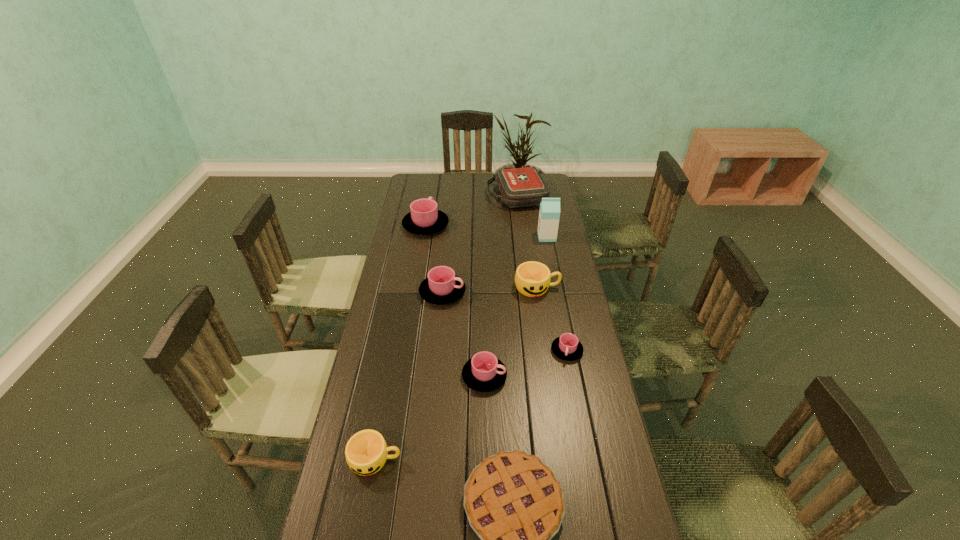
What are the coordinates of `the left beige cup` in the screenshot? It's located at (366, 452).

Where is `the nearer beige cup`? Image resolution: width=960 pixels, height=540 pixels. the nearer beige cup is located at coordinates (366, 452).

Image resolution: width=960 pixels, height=540 pixels. What are the coordinates of `the smallest pink cup` in the screenshot? It's located at (567, 347).

Where is `the rightmost pink cup`? the rightmost pink cup is located at coordinates (567, 347).

Identify the location of free space located on the left of the tallest object. (514, 237).

Find the location of a particular element. vacant space located on the side with the handle of the tallest cup is located at coordinates (432, 186).

The height and width of the screenshot is (540, 960). What are the coordinates of `vacant region located 0.280m on the side with the handle of the tallest cup` in the screenshot? It's located at (433, 184).

This screenshot has width=960, height=540. In order to click on vacant space located 0.250m on the side with the handle of the tallest cup in this screenshot , I will do `click(432, 187)`.

Identify the location of free space located on the left of the first-aid kit. [450, 196].

Where is `vacant space located 0.250m on the side with the handle of the second biggest pink cup`? vacant space located 0.250m on the side with the handle of the second biggest pink cup is located at coordinates (530, 292).